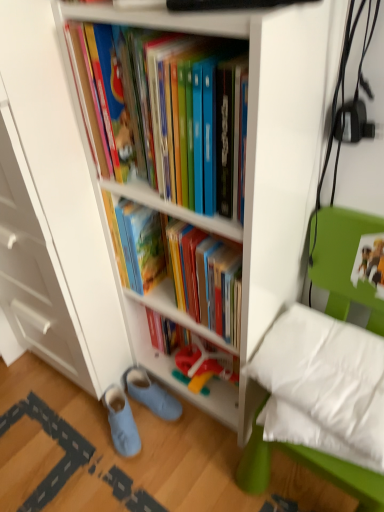
Question: From the image's perspective, would you say white soft pillow at lower right is positioned over light blue fabric slippers at lower left, the 2th footwear when ordered from right to left?

Choices:
 (A) yes
 (B) no

Answer: (A)

Question: Is the depth of white soft pillow at lower right greater than that of light blue fabric slippers at lower left, placed as the 1th footwear when sorted from left to right?

Choices:
 (A) yes
 (B) no

Answer: (B)

Question: Is white soft pillow at lower right looking in the opposite direction of light blue fabric slippers at lower left, the 2th footwear when ordered from right to left?

Choices:
 (A) yes
 (B) no

Answer: (B)

Question: Is white soft pillow at lower right not within light blue fabric slippers at lower left, placed as the 1th footwear when sorted from left to right?

Choices:
 (A) yes
 (B) no

Answer: (A)

Question: Does white soft pillow at lower right contain light blue fabric slippers at lower left, placed as the 1th footwear when sorted from left to right?

Choices:
 (A) yes
 (B) no

Answer: (B)

Question: From their relative heights in the image, would you say matte plastic shelf at center is taller or shorter than blue suede slippers at lower left, the 1th footwear positioned from the right?

Choices:
 (A) tall
 (B) short

Answer: (A)

Question: From a real-world perspective, is matte plastic shelf at center positioned above or below blue suede slippers at lower left, arranged as the second footwear when viewed from the left?

Choices:
 (A) above
 (B) below

Answer: (A)

Question: Looking at their shapes, would you say matte plastic shelf at center is wider or thinner than blue suede slippers at lower left, arranged as the second footwear when viewed from the left?

Choices:
 (A) thin
 (B) wide

Answer: (A)

Question: Considering the relative positions of matte plastic shelf at center and blue suede slippers at lower left, the 1th footwear positioned from the right, in the image provided, is matte plastic shelf at center to the left or to the right of blue suede slippers at lower left, the 1th footwear positioned from the right,?

Choices:
 (A) left
 (B) right

Answer: (B)

Question: From the image's perspective, is light blue fabric slippers at lower left, the 2th footwear when ordered from right to left, located above or below white glossy bookcase at center?

Choices:
 (A) below
 (B) above

Answer: (A)

Question: Looking at their shapes, would you say light blue fabric slippers at lower left, the 2th footwear when ordered from right to left, is wider or thinner than white glossy bookcase at center?

Choices:
 (A) thin
 (B) wide

Answer: (A)

Question: Visually, is light blue fabric slippers at lower left, placed as the 1th footwear when sorted from left to right, positioned to the left or to the right of white glossy bookcase at center?

Choices:
 (A) left
 (B) right

Answer: (A)

Question: From a real-world perspective, is light blue fabric slippers at lower left, the 2th footwear when ordered from right to left, physically located above or below white glossy bookcase at center?

Choices:
 (A) above
 (B) below

Answer: (B)

Question: Based on their sizes in the image, would you say light blue fabric slippers at lower left, placed as the 1th footwear when sorted from left to right, is bigger or smaller than white soft pillow at lower right?

Choices:
 (A) small
 (B) big

Answer: (A)

Question: Considering their positions, is light blue fabric slippers at lower left, placed as the 1th footwear when sorted from left to right, located in front of or behind white soft pillow at lower right?

Choices:
 (A) front
 (B) behind

Answer: (B)